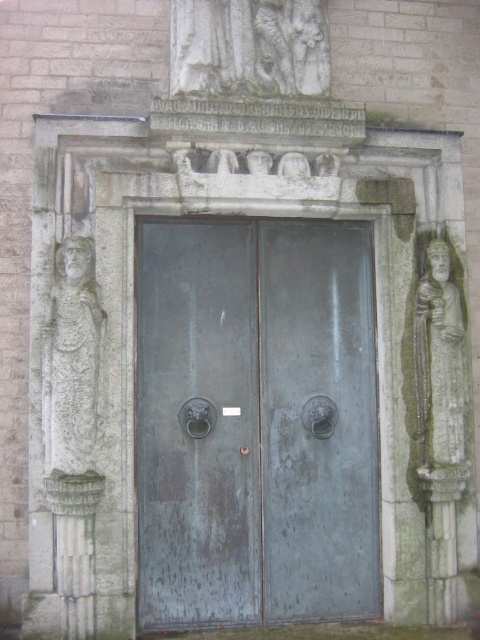
Who is higher up, bronze/weathered metal door at center or green stone column at lower left?

bronze/weathered metal door at center

Is bronze/weathered metal door at center wider than green stone column at lower left?

Correct, the width of bronze/weathered metal door at center exceeds that of green stone column at lower left.

What do you see at coordinates (255, 422) in the screenshot? I see `bronze/weathered metal door at center` at bounding box center [255, 422].

Find the location of a particular element. This screenshot has height=640, width=480. bronze/weathered metal door at center is located at coordinates (255, 422).

Does bronze/weathered metal door at center appear under green stone statue at right?

Correct, bronze/weathered metal door at center is located below green stone statue at right.

Who is taller, bronze/weathered metal door at center or green stone statue at right?

bronze/weathered metal door at center

Where is `bronze/weathered metal door at center`? The width and height of the screenshot is (480, 640). bronze/weathered metal door at center is located at coordinates (255, 422).

Identify the location of bronze/weathered metal door at center. The width and height of the screenshot is (480, 640). (255, 422).

Is bronze/weathered metal door at center taller than carved stone figure at left?

Yes, bronze/weathered metal door at center is taller than carved stone figure at left.

Does bronze/weathered metal door at center have a larger size compared to carved stone figure at left?

Correct, bronze/weathered metal door at center is larger in size than carved stone figure at left.

What do you see at coordinates (255, 422) in the screenshot? I see `bronze/weathered metal door at center` at bounding box center [255, 422].

Locate an element on the screen. bronze/weathered metal door at center is located at coordinates (255, 422).